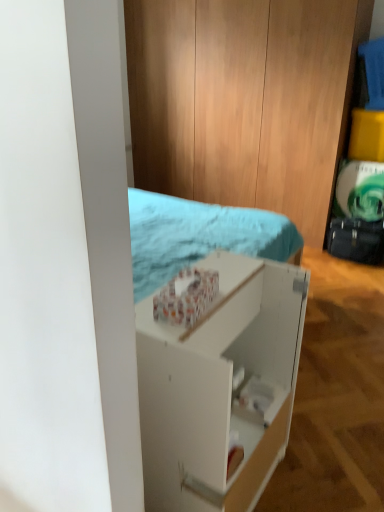
Question: Considering the relative sizes of black leather suitcase at right and white matte shelf at center in the image provided, is black leather suitcase at right taller than white matte shelf at center?

Choices:
 (A) no
 (B) yes

Answer: (A)

Question: Does black leather suitcase at right lie in front of white matte shelf at center?

Choices:
 (A) no
 (B) yes

Answer: (A)

Question: Can you confirm if black leather suitcase at right is shorter than white matte shelf at center?

Choices:
 (A) no
 (B) yes

Answer: (B)

Question: From a real-world perspective, is black leather suitcase at right under white matte shelf at center?

Choices:
 (A) yes
 (B) no

Answer: (A)

Question: Does black leather suitcase at right have a greater width compared to white matte shelf at center?

Choices:
 (A) no
 (B) yes

Answer: (A)

Question: Is black leather suitcase at right outside white matte shelf at center?

Choices:
 (A) yes
 (B) no

Answer: (A)

Question: Considering the relative sizes of white matte shelf at center and black leather suitcase at right in the image provided, is white matte shelf at center shorter than black leather suitcase at right?

Choices:
 (A) yes
 (B) no

Answer: (B)

Question: Considering the relative sizes of white matte shelf at center and black leather suitcase at right in the image provided, is white matte shelf at center smaller than black leather suitcase at right?

Choices:
 (A) no
 (B) yes

Answer: (A)

Question: From the image's perspective, is white matte shelf at center located above black leather suitcase at right?

Choices:
 (A) yes
 (B) no

Answer: (B)

Question: Is white matte shelf at center aimed at black leather suitcase at right?

Choices:
 (A) no
 (B) yes

Answer: (A)

Question: From a real-world perspective, is white matte shelf at center beneath black leather suitcase at right?

Choices:
 (A) no
 (B) yes

Answer: (A)

Question: Can we say white matte shelf at center lies outside black leather suitcase at right?

Choices:
 (A) no
 (B) yes

Answer: (B)

Question: Based on their sizes in the image, would you say black leather suitcase at right is bigger or smaller than white matte shelf at center?

Choices:
 (A) big
 (B) small

Answer: (B)